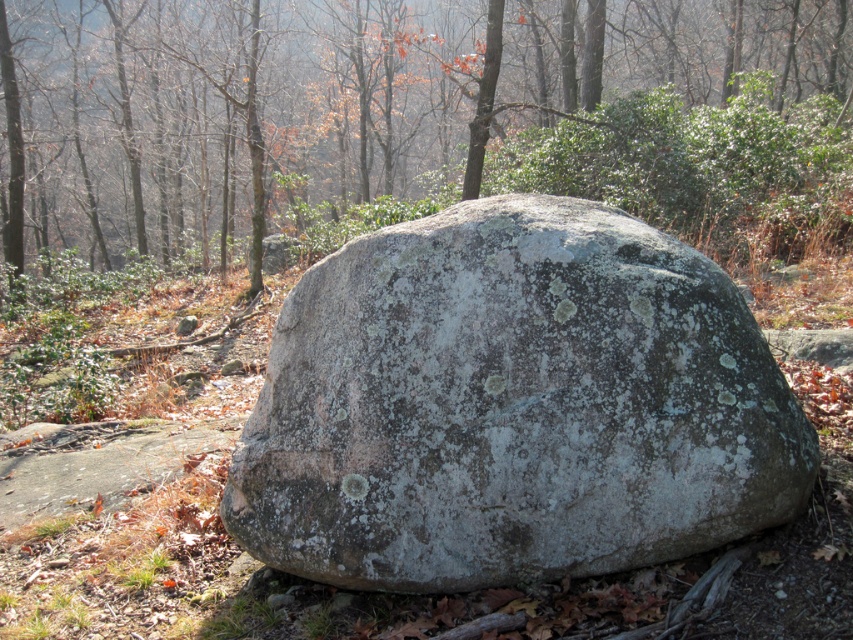
Who is lower down, green lichen-covered rock at center or speckled gray rock at center?

speckled gray rock at center is below.

Does green lichen-covered rock at center have a greater height compared to speckled gray rock at center?

Yes, green lichen-covered rock at center is taller than speckled gray rock at center.

The height and width of the screenshot is (640, 853). Find the location of `green lichen-covered rock at center`. green lichen-covered rock at center is located at coordinates (416, 122).